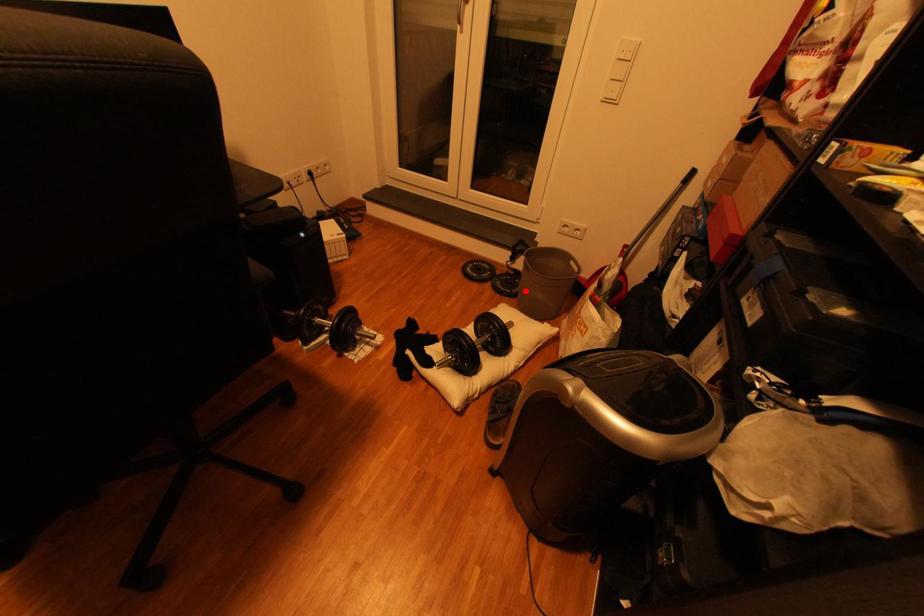
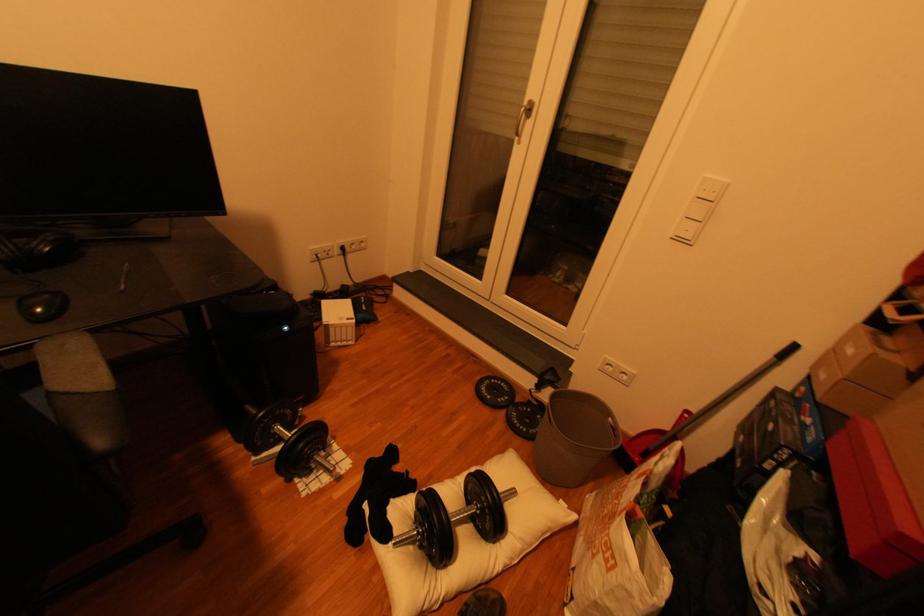
In the second image, find the point that corresponds to the highlighted location in the first image.

(543, 431)